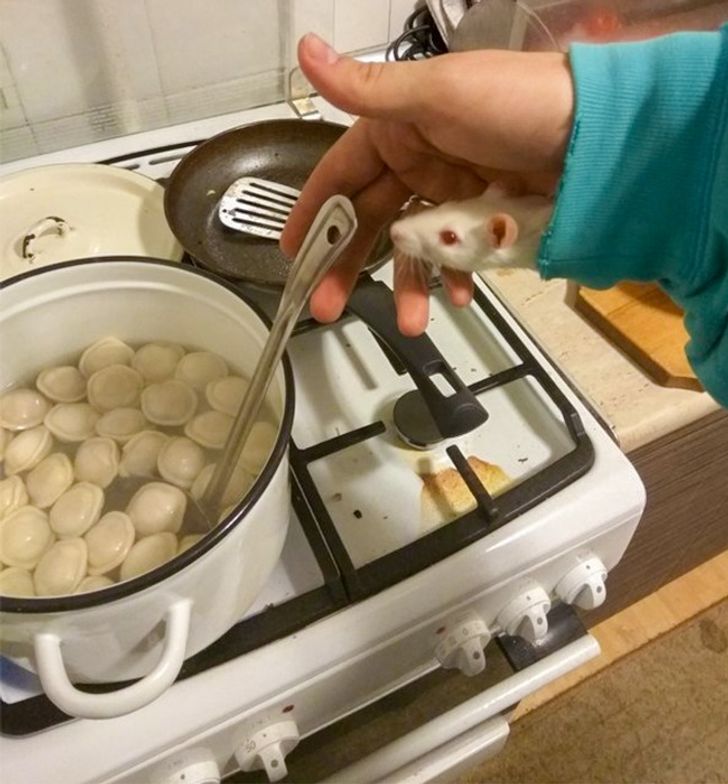
Locate an element on the screen. This screenshot has width=728, height=784. wall is located at coordinates (159, 45).